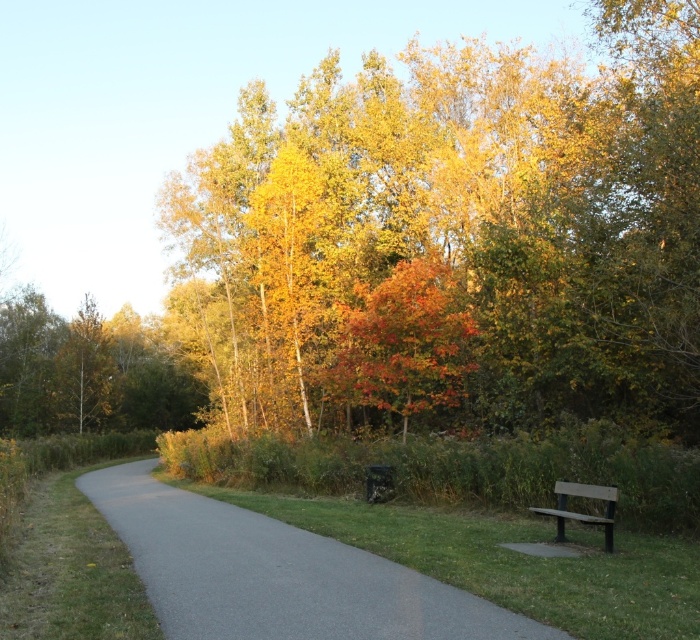
You are standing at the point marked by the coordinates point (455,240). Looking around, you see golden yellow leaves at upper center. Which direction should you walk to reach the wooden bench on the right side of the path?

The golden yellow leaves at upper center are located at point (455,240). The wooden bench on the right side of the path is to the right of the path, so you should walk towards the right side of the path to reach it.